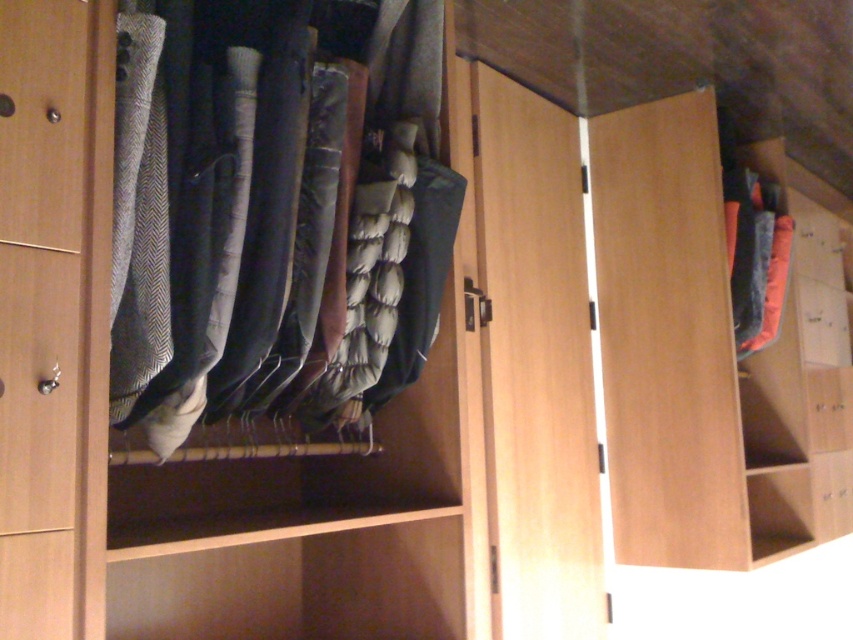
You are trying to place a new pair of shoes in the wardrobe. The wooden shelf at right has limited space. Can you determine if the point at coordinates point (699, 353) is located on the wooden shelf at right?

Yes, the point (699, 353) is on the wooden shelf at right, so placing the shoes there would be possible.